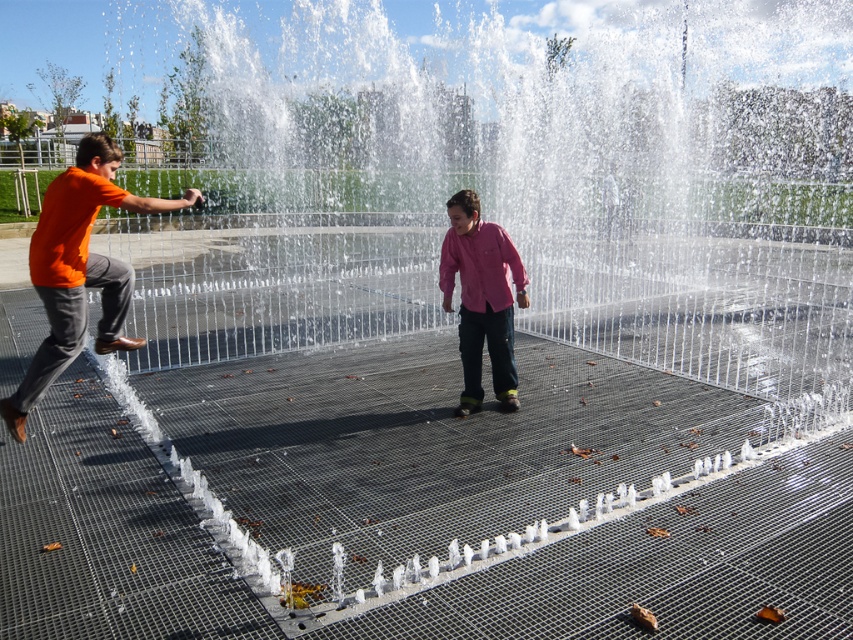
At what (x,y) coordinates should I click in order to perform the action: click on orange matte shirt at left. Please return your answer as a coordinate pair (x, y). The width and height of the screenshot is (853, 640). Looking at the image, I should click on (78, 269).

Can you confirm if orange matte shirt at left is taller than pink matte shirt at center?

Correct, orange matte shirt at left is much taller as pink matte shirt at center.

The height and width of the screenshot is (640, 853). Find the location of `orange matte shirt at left`. orange matte shirt at left is located at coordinates (78, 269).